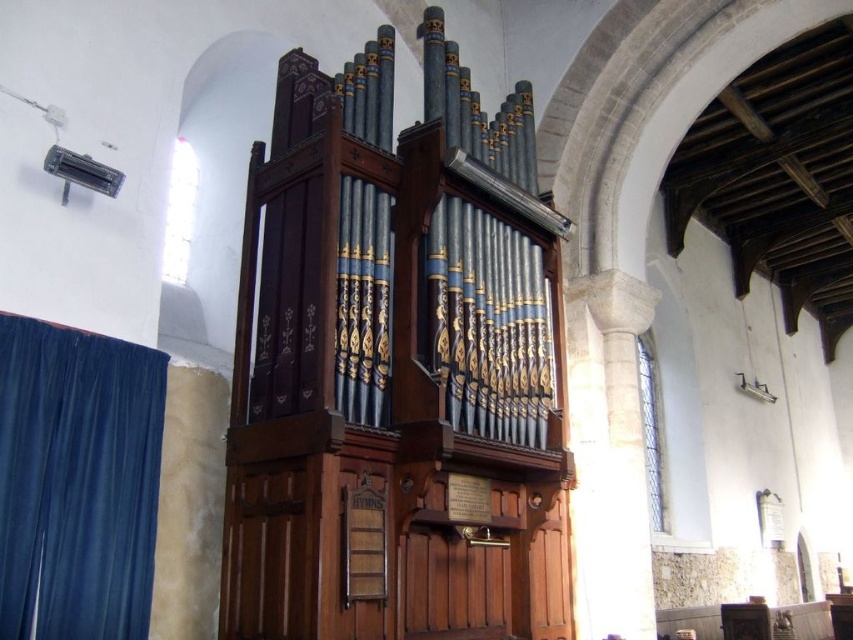
You are a stagehand setting up a temporary platform for a performance. The platform requires a clear space of at least 6 feet between the wooden pipe organ at center and the velvet blue curtain at left. Based on the image description, do you think the existing space between them is sufficient?

The distance between the wooden pipe organ at center and the velvet blue curtain at left is 5.35 feet, which is less than the required 6 feet. Therefore, the existing space is insufficient for the platform setup.

You are a stagehand preparing to install a new spotlight. The spotlight requires a minimum height clearance of 3 meters to avoid obstruction. Given the wooden pipe organ at center and the velvet blue curtain at left, which object might interfere with the installation based on their heights?

The wooden pipe organ at center is taller than the velvet blue curtain at left, so it might interfere with the installation of the spotlight due to its greater height.

What object is located at the coordinates point (396, 368) in the image?

The point (396, 368) indicates the wooden pipe organ at center.